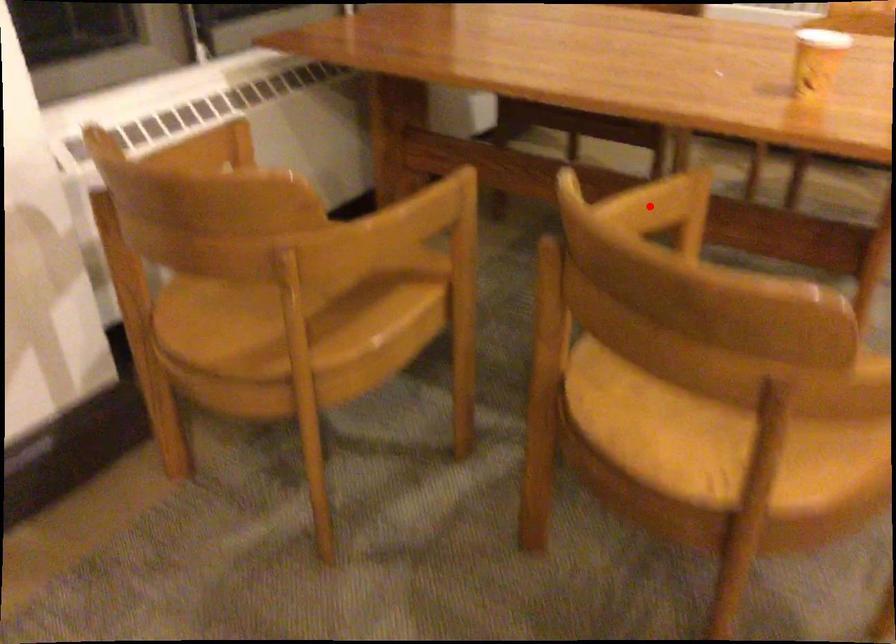
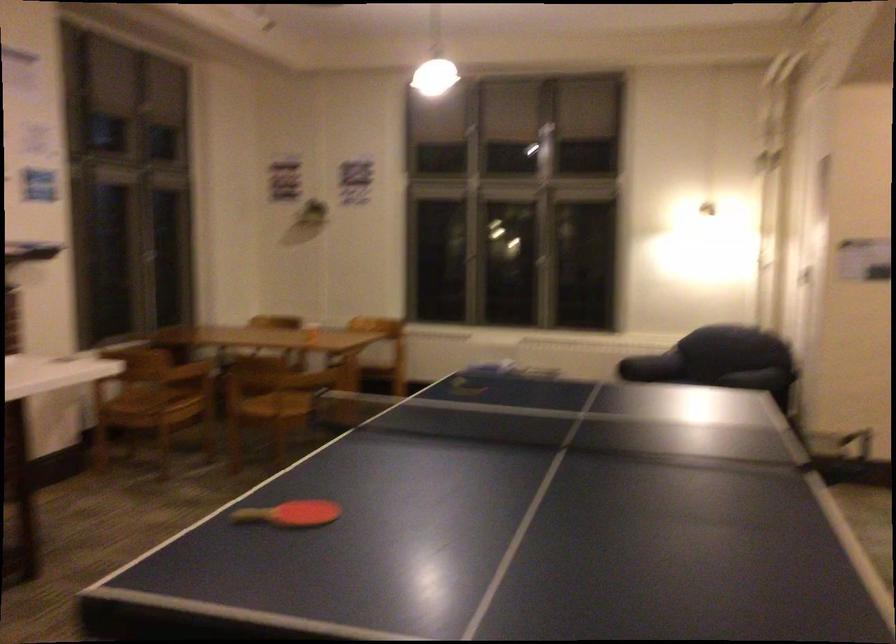
Question: I am providing you with two images of the same scene from different viewpoints. A red point is marked on the first image. At the location where the point appears in image 1, is it still visible in image 2?

Choices:
 (A) Yes
 (B) No

Answer: (B)